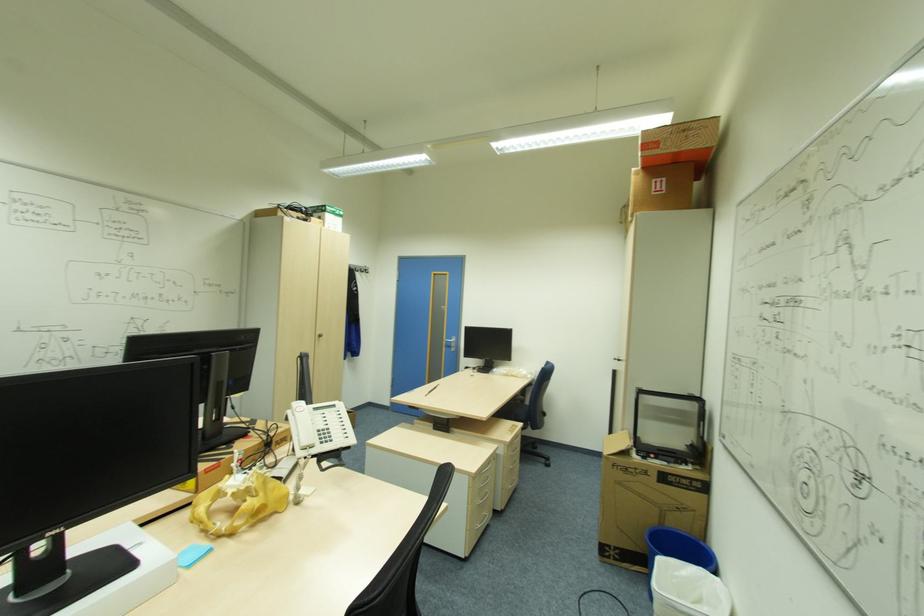
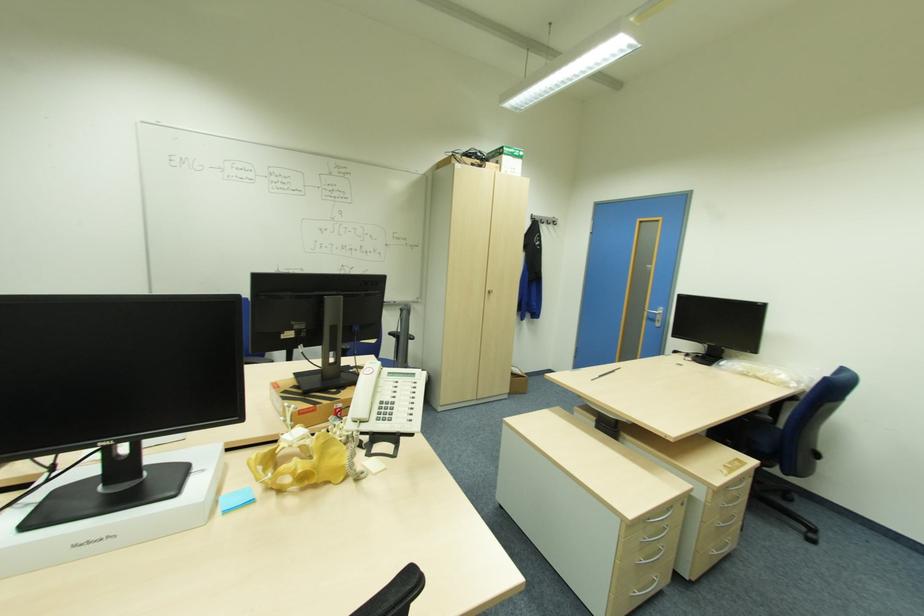
The point at (492, 463) is marked in the first image. Where is the corresponding point in the second image?

(672, 511)